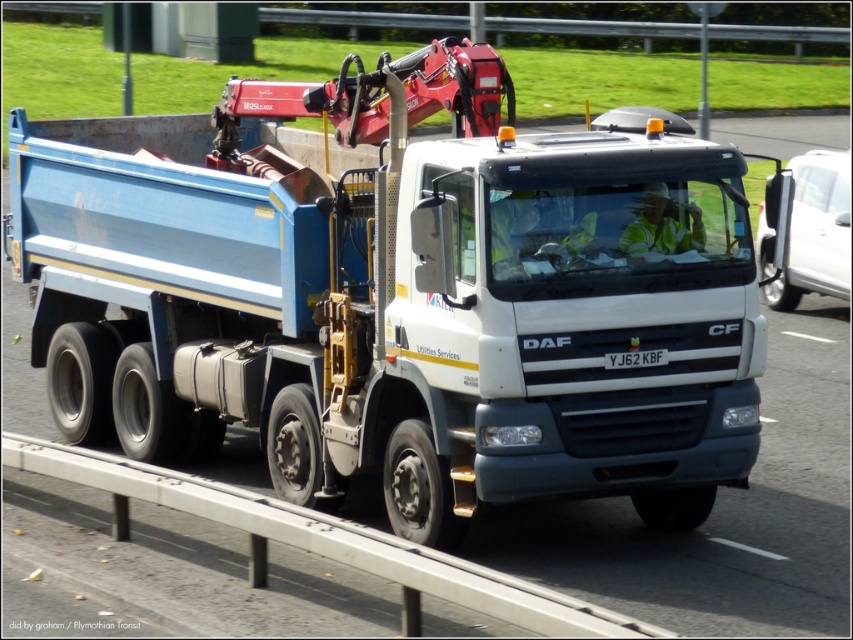
Question: Can you confirm if matte blue truck at center is positioned to the right of black plastic license plate at center?

Choices:
 (A) no
 (B) yes

Answer: (A)

Question: Among these objects, which one is nearest to the camera?

Choices:
 (A) matte blue truck at center
 (B) black plastic license plate at center

Answer: (B)

Question: Among these objects, which one is nearest to the camera?

Choices:
 (A) black plastic license plate at center
 (B) matte blue truck at center

Answer: (A)

Question: Is matte blue truck at center smaller than black plastic license plate at center?

Choices:
 (A) no
 (B) yes

Answer: (A)

Question: Does matte blue truck at center have a lesser width compared to black plastic license plate at center?

Choices:
 (A) yes
 (B) no

Answer: (B)